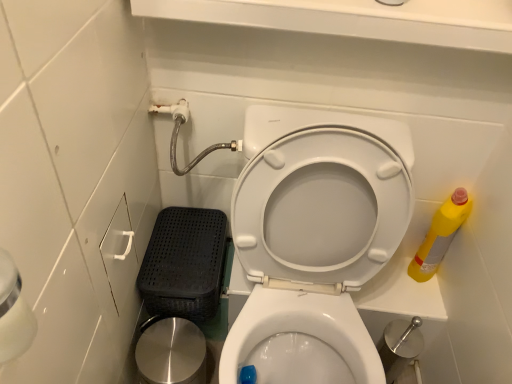
Question: Is white glossy toilet seat at center wider than yellow plastic bottle at right?

Choices:
 (A) yes
 (B) no

Answer: (A)

Question: Are white glossy toilet seat at center and yellow plastic bottle at right making contact?

Choices:
 (A) no
 (B) yes

Answer: (A)

Question: Is white glossy toilet seat at center closer to camera compared to yellow plastic bottle at right?

Choices:
 (A) yes
 (B) no

Answer: (A)

Question: From the image's perspective, does white glossy toilet seat at center appear higher than yellow plastic bottle at right?

Choices:
 (A) yes
 (B) no

Answer: (B)

Question: From a real-world perspective, is white glossy toilet seat at center positioned over yellow plastic bottle at right based on gravity?

Choices:
 (A) no
 (B) yes

Answer: (A)

Question: Is the depth of white glossy toilet seat at center greater than that of yellow plastic bottle at right?

Choices:
 (A) yes
 (B) no

Answer: (B)

Question: Does polished stainless steel potty at lower left contain yellow plastic bottle at right?

Choices:
 (A) no
 (B) yes

Answer: (A)

Question: Are polished stainless steel potty at lower left and yellow plastic bottle at right beside each other?

Choices:
 (A) yes
 (B) no

Answer: (B)

Question: Does polished stainless steel potty at lower left have a greater height compared to yellow plastic bottle at right?

Choices:
 (A) no
 (B) yes

Answer: (A)

Question: Is polished stainless steel potty at lower left at the left side of yellow plastic bottle at right?

Choices:
 (A) yes
 (B) no

Answer: (A)

Question: Does polished stainless steel potty at lower left have a lesser width compared to yellow plastic bottle at right?

Choices:
 (A) yes
 (B) no

Answer: (B)

Question: From a real-world perspective, is polished stainless steel potty at lower left positioned under yellow plastic bottle at right based on gravity?

Choices:
 (A) yes
 (B) no

Answer: (A)

Question: Would you say white glossy toilet seat at center is outside polished stainless steel potty at lower left?

Choices:
 (A) no
 (B) yes

Answer: (B)